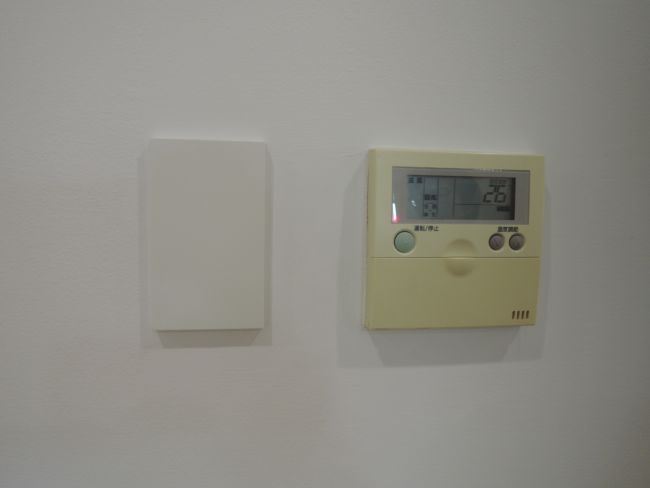
You are a GUI agent. You are given a task and a screenshot of the screen. Output one action in this format:
    pyautogui.click(x=<x>, y=<y>)
    Task: Click on the white wall
    Image resolution: width=650 pixels, height=488 pixels.
    Given the screenshot: What is the action you would take?
    pyautogui.click(x=338, y=90)